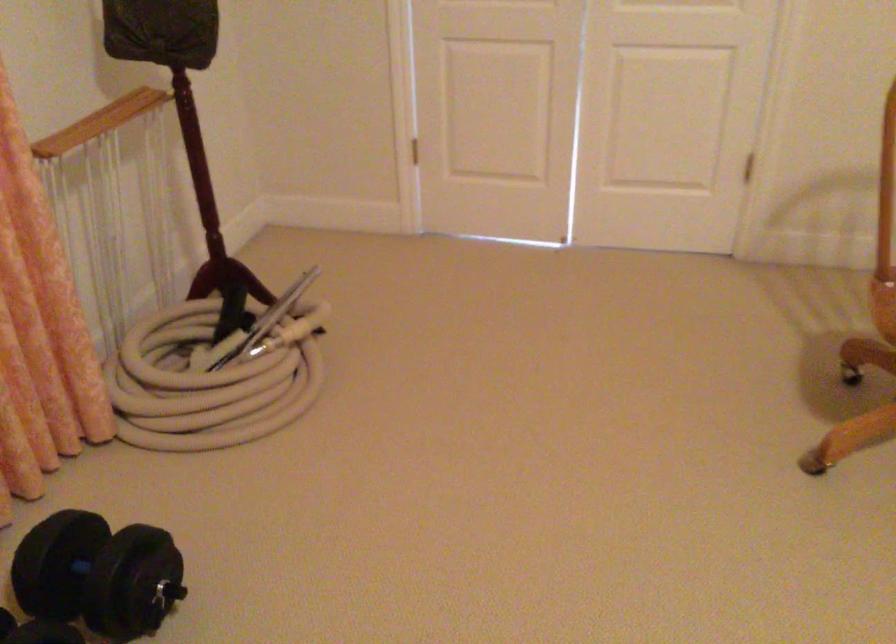
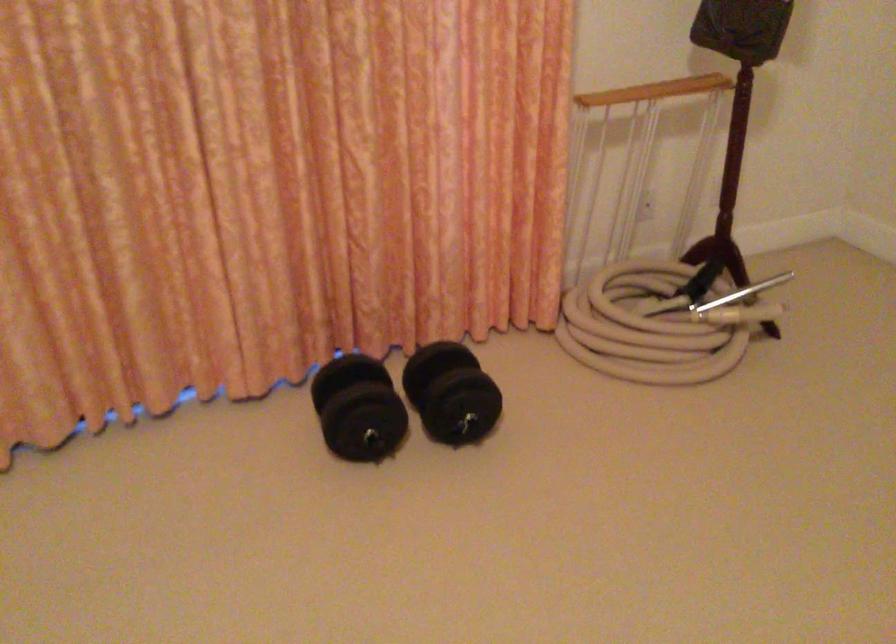
Question: Based on the continuous images, in which direction is the camera rotating? Reply with the corresponding letter.

Choices:
 (A) Left
 (B) Right
 (C) Up
 (D) Down

Answer: (A)